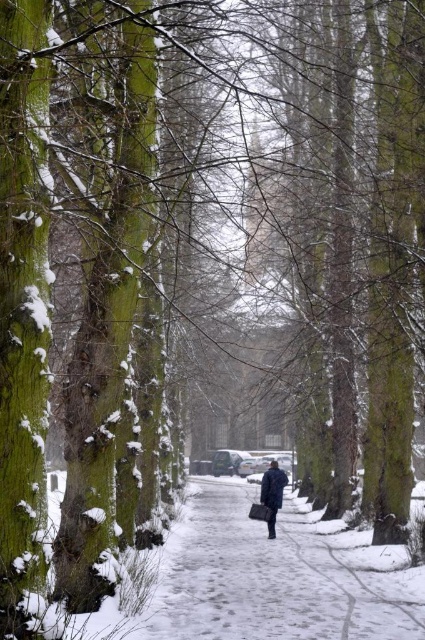
Is the position of white snow-covered pavement at center less distant than that of dark blue coat at center?

Yes, it is in front of dark blue coat at center.

Does white snow-covered pavement at center have a greater width compared to dark blue coat at center?

Correct, the width of white snow-covered pavement at center exceeds that of dark blue coat at center.

Measure the distance between white snow-covered pavement at center and camera.

white snow-covered pavement at center and camera are 10.97 meters apart.

The image size is (425, 640). I want to click on white snow-covered pavement at center, so click(269, 580).